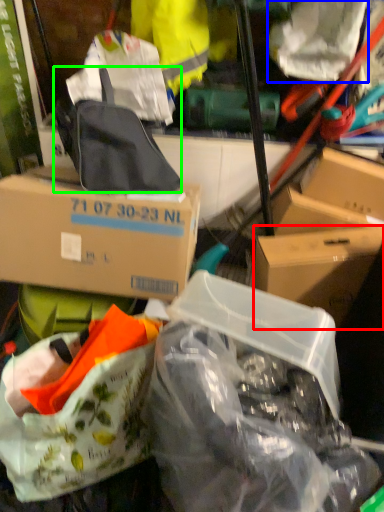
Question: Which object is positioned farthest from box (highlighted by a red box)? Select from plastic bag (highlighted by a blue box) and backpack (highlighted by a green box).

Choices:
 (A) plastic bag
 (B) backpack

Answer: (A)